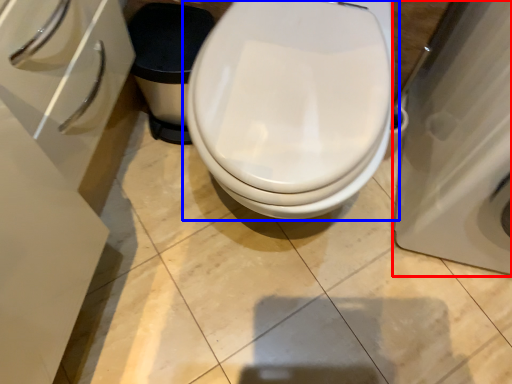
Question: Among these objects, which one is nearest to the camera, porcelain (highlighted by a red box) or toilet (highlighted by a blue box)?

Choices:
 (A) porcelain
 (B) toilet

Answer: (A)